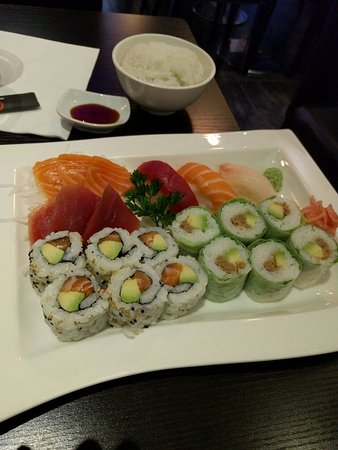
Identify the location of floor. (252, 89).